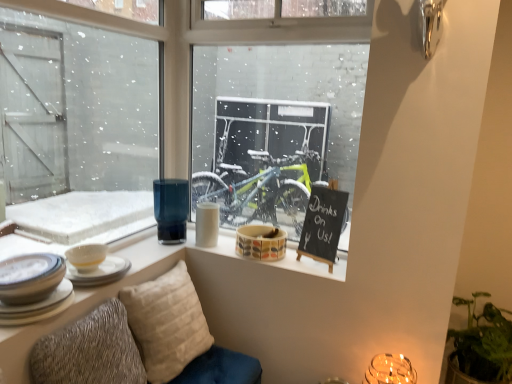
Locate an element on the screen. This screenshot has height=384, width=512. free point to the left of black chalkboard at upper right is located at coordinates [294, 259].